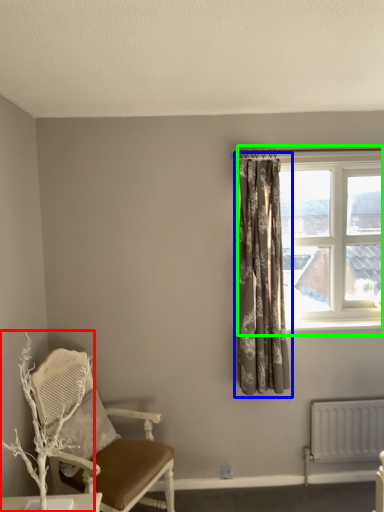
Question: Considering the real-world distances, which object is farthest from branch (highlighted by a red box)? curtain (highlighted by a blue box) or window (highlighted by a green box)?

Choices:
 (A) curtain
 (B) window

Answer: (B)